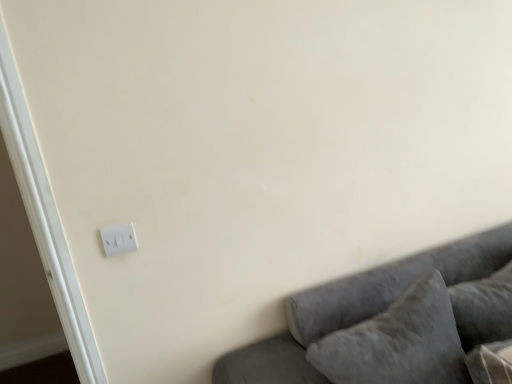
Question: Is velvet gray pillow at lower right, which is the first pillow from left to right, oriented away from velvet gray couch at lower right?

Choices:
 (A) no
 (B) yes

Answer: (B)

Question: Is velvet gray pillow at lower right, marked as the second pillow in a right-to-left arrangement, in contact with velvet gray couch at lower right?

Choices:
 (A) no
 (B) yes

Answer: (A)

Question: Are velvet gray pillow at lower right, marked as the second pillow in a right-to-left arrangement, and velvet gray couch at lower right located far from each other?

Choices:
 (A) no
 (B) yes

Answer: (A)

Question: From the image's perspective, would you say velvet gray pillow at lower right, which is the first pillow from left to right, is shown under velvet gray couch at lower right?

Choices:
 (A) yes
 (B) no

Answer: (B)

Question: Is velvet gray pillow at lower right, marked as the second pillow in a right-to-left arrangement, not within velvet gray couch at lower right?

Choices:
 (A) no
 (B) yes

Answer: (A)

Question: Considering the positions of velvet gray pillow at lower right, which is the first pillow from left to right, and white plastic light switch at lower left in the image, is velvet gray pillow at lower right, which is the first pillow from left to right, wider or thinner than white plastic light switch at lower left?

Choices:
 (A) thin
 (B) wide

Answer: (B)

Question: From a real-world perspective, is velvet gray pillow at lower right, marked as the second pillow in a right-to-left arrangement, physically located above or below white plastic light switch at lower left?

Choices:
 (A) above
 (B) below

Answer: (B)

Question: Is velvet gray pillow at lower right, marked as the second pillow in a right-to-left arrangement, in front of or behind white plastic light switch at lower left in the image?

Choices:
 (A) front
 (B) behind

Answer: (A)

Question: Is point (444, 377) closer or farther from the camera than point (109, 243)?

Choices:
 (A) farther
 (B) closer

Answer: (B)

Question: Considering the positions of velvet gray couch at lower right and white plastic light switch at lower left in the image, is velvet gray couch at lower right taller or shorter than white plastic light switch at lower left?

Choices:
 (A) short
 (B) tall

Answer: (B)

Question: Is velvet gray couch at lower right to the left or to the right of white plastic light switch at lower left in the image?

Choices:
 (A) right
 (B) left

Answer: (A)

Question: Is point (315, 331) closer or farther from the camera than point (121, 238)?

Choices:
 (A) farther
 (B) closer

Answer: (A)

Question: In terms of width, does velvet gray couch at lower right look wider or thinner when compared to white plastic light switch at lower left?

Choices:
 (A) wide
 (B) thin

Answer: (A)

Question: Considering the positions of velvety gray pillow at lower right, the 1th pillow in the right-to-left sequence, and white plastic light switch at lower left in the image, is velvety gray pillow at lower right, the 1th pillow in the right-to-left sequence, bigger or smaller than white plastic light switch at lower left?

Choices:
 (A) big
 (B) small

Answer: (A)

Question: Does point (508, 317) appear closer or farther from the camera than point (131, 236)?

Choices:
 (A) closer
 (B) farther

Answer: (B)